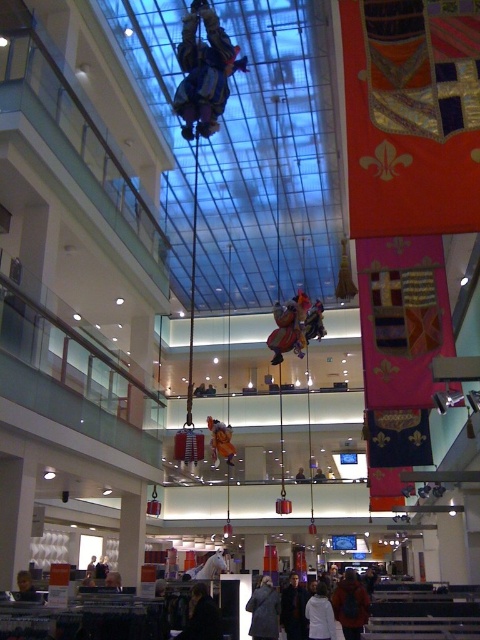
Based on the photo, you are a visitor in the mall and want to take a photo of the dark gray jacket at lower center. However, the dark blue jacket at center is blocking your view. Can you move around to get an unobstructed shot?

The dark gray jacket at lower center is behind the dark blue jacket at center, so moving around to the side or behind the dark blue jacket at center might allow you to see the dark gray jacket at lower center without obstruction.

You are a visitor standing at the entrance of the mall and want to take a photo of the reflective silver helmet at center. Which direction should you face to ensure the helmet is in the center of your camera view?

Since the reflective silver helmet at center is located at point coordinates of 0.113 on the x axis and 0.425 on the y axis, you should face towards the center of the mall to capture it in your camera view.